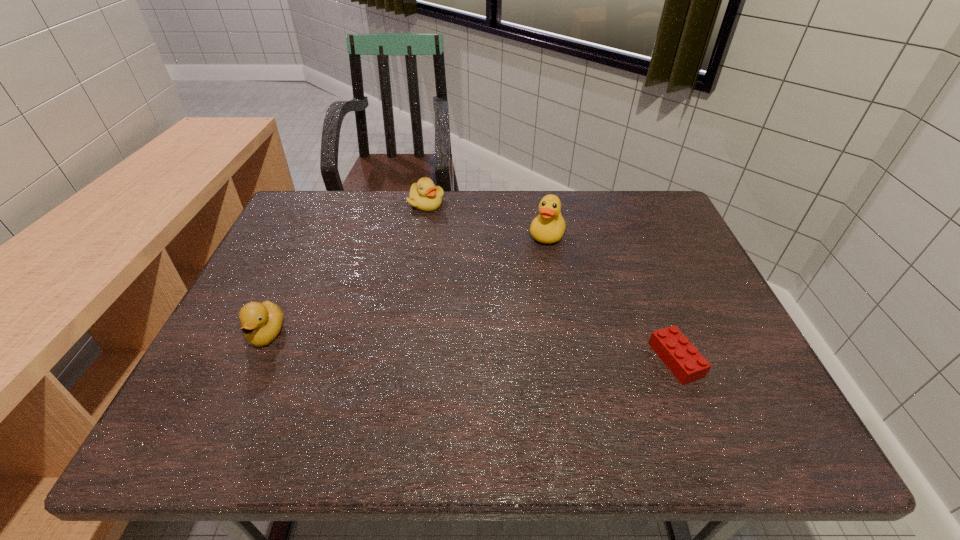
The image size is (960, 540). Find the location of `vacant point located 0.380m at the beak of the duck`. vacant point located 0.380m at the beak of the duck is located at coordinates (502, 349).

Identify the location of free space located at the beak of the duck. (518, 309).

Locate an element on the screen. This screenshot has width=960, height=540. vacant space located at the beak of the duck is located at coordinates (539, 258).

Locate an element on the screen. This screenshot has height=540, width=960. free region located 0.340m on the front-facing side of the farther duckling is located at coordinates (431, 289).

Locate an element on the screen. blank area located 0.270m on the front-facing side of the farther duckling is located at coordinates (430, 271).

Find the location of a particular element. Image resolution: width=960 pixels, height=540 pixels. vacant space located 0.320m on the front-facing side of the farther duckling is located at coordinates (x=431, y=284).

Where is `duck at the far edge`? The height and width of the screenshot is (540, 960). duck at the far edge is located at coordinates (548, 227).

This screenshot has width=960, height=540. Find the location of `duckling located at the far edge`. duckling located at the far edge is located at coordinates (424, 195).

The height and width of the screenshot is (540, 960). I want to click on object positioned at the near edge, so click(682, 358).

This screenshot has height=540, width=960. I want to click on object at the left edge, so click(x=261, y=323).